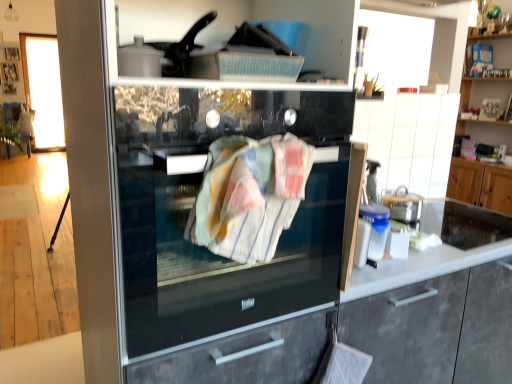
Question: Does white glossy countertop at right contain black glass fridge at center?

Choices:
 (A) yes
 (B) no

Answer: (B)

Question: Is white glossy countertop at right at the right side of black glass fridge at center?

Choices:
 (A) yes
 (B) no

Answer: (A)

Question: Can you confirm if white glossy countertop at right is positioned to the left of black glass fridge at center?

Choices:
 (A) yes
 (B) no

Answer: (B)

Question: Does white glossy countertop at right lie in front of black glass fridge at center?

Choices:
 (A) yes
 (B) no

Answer: (B)

Question: From the image's perspective, is white glossy countertop at right under black glass fridge at center?

Choices:
 (A) yes
 (B) no

Answer: (B)

Question: Based on their sizes in the image, would you say matte gray cabinet at center, marked as the 2th cabinetry in a right-to-left arrangement, is bigger or smaller than striped cotton towel at center?

Choices:
 (A) small
 (B) big

Answer: (B)

Question: Is matte gray cabinet at center, the second cabinetry from the left, in front of or behind striped cotton towel at center in the image?

Choices:
 (A) front
 (B) behind

Answer: (B)

Question: Is matte gray cabinet at center, arranged as the first cabinetry when viewed from the front, wider or thinner than striped cotton towel at center?

Choices:
 (A) wide
 (B) thin

Answer: (A)

Question: Do you think matte gray cabinet at center, arranged as the first cabinetry when viewed from the front, is within striped cotton towel at center, or outside of it?

Choices:
 (A) outside
 (B) inside

Answer: (A)

Question: Does point (267, 243) appear closer or farther from the camera than point (478, 316)?

Choices:
 (A) closer
 (B) farther

Answer: (A)

Question: Considering the positions of striped cotton towel at center and matte gray cabinet at center, marked as the 2th cabinetry in a right-to-left arrangement, in the image, is striped cotton towel at center bigger or smaller than matte gray cabinet at center, marked as the 2th cabinetry in a right-to-left arrangement,?

Choices:
 (A) big
 (B) small

Answer: (B)

Question: From a real-world perspective, relative to matte gray cabinet at center, arranged as the first cabinetry when viewed from the front, is striped cotton towel at center vertically above or below?

Choices:
 (A) above
 (B) below

Answer: (A)

Question: Considering their positions, is striped cotton towel at center located in front of or behind matte gray cabinet at center, which ranks as the 3th cabinetry in back-to-front order?

Choices:
 (A) front
 (B) behind

Answer: (A)

Question: Is white tile cabinetry at upper right, the 3th cabinetry from the right, in front of or behind white glossy countertop at right in the image?

Choices:
 (A) behind
 (B) front

Answer: (A)

Question: Based on their sizes in the image, would you say white tile cabinetry at upper right, the 3th cabinetry from the right, is bigger or smaller than white glossy countertop at right?

Choices:
 (A) small
 (B) big

Answer: (A)